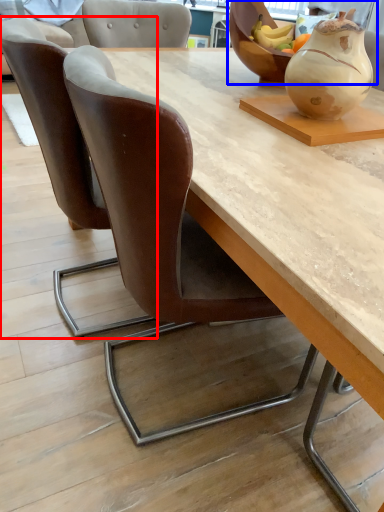
Question: Which object is further to the camera taking this photo, chair (highlighted by a red box) or bowl (highlighted by a blue box)?

Choices:
 (A) chair
 (B) bowl

Answer: (B)